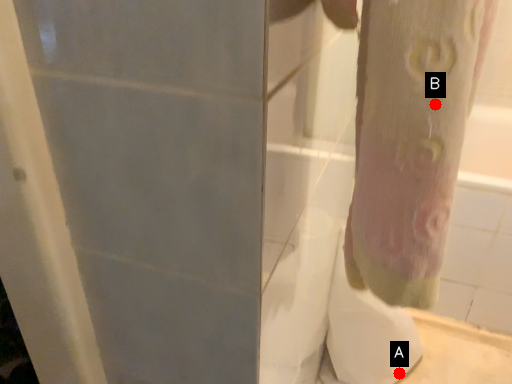
Question: Two points are circled on the image, labeled by A and B beside each circle. Which point is closer to the camera?

Choices:
 (A) A is closer
 (B) B is closer

Answer: (B)